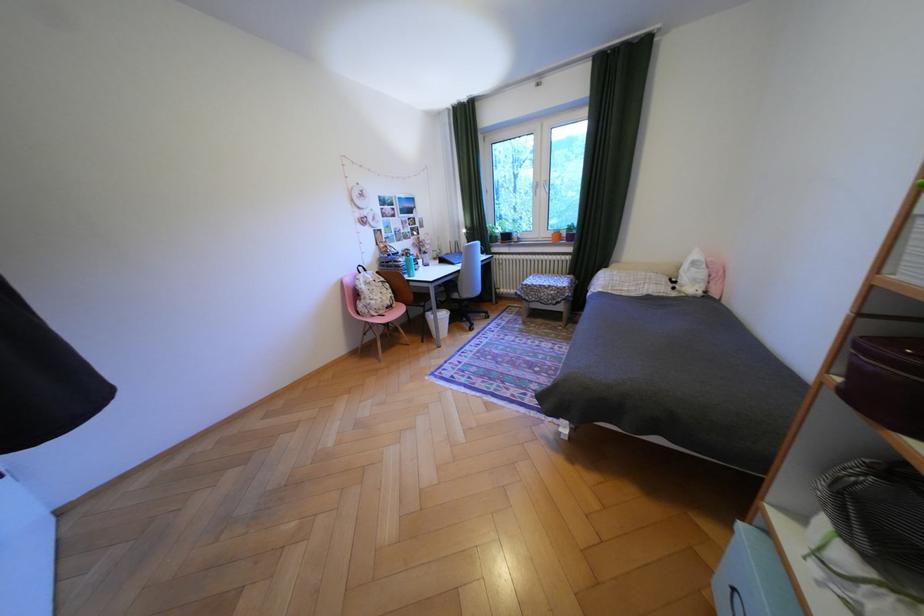
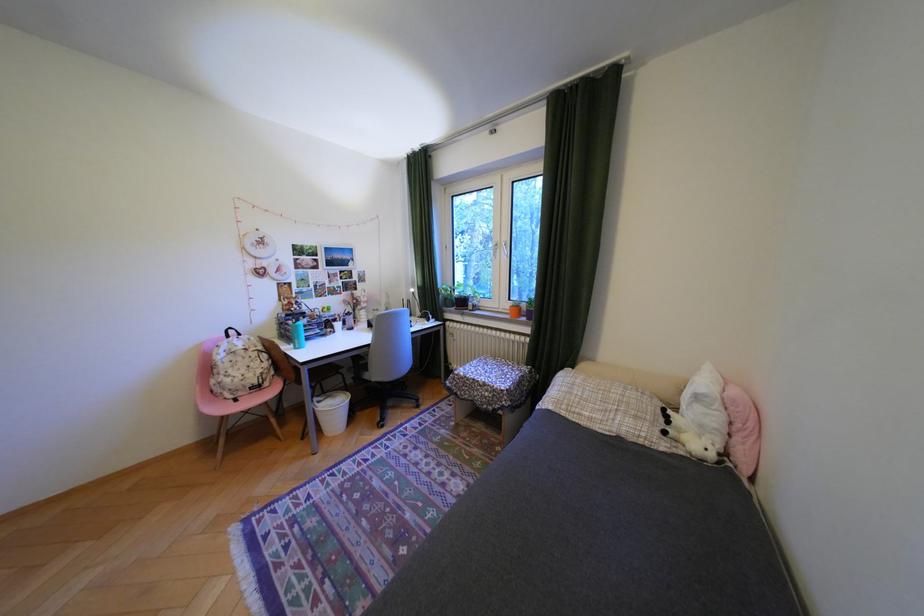
Where in the second image is the point corresponding to [518,238] from the first image?

(475, 302)